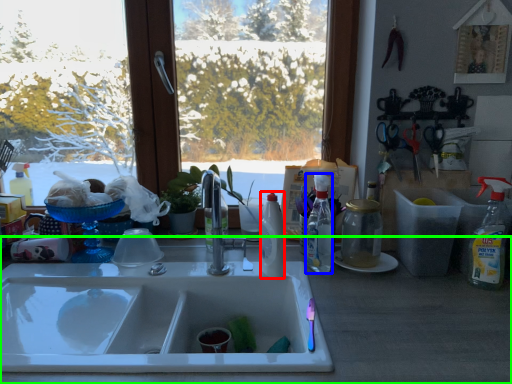
Question: Estimate the real-world distances between objects in this image. Which object is closer to bottle (highlighted by a red box), bottle (highlighted by a blue box) or counter top (highlighted by a green box)?

Choices:
 (A) bottle
 (B) counter top

Answer: (A)